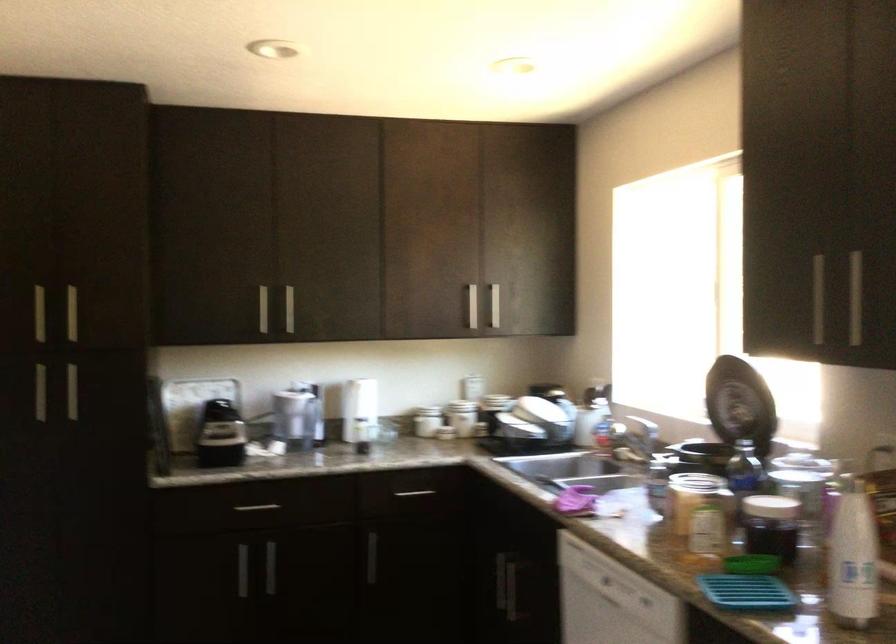
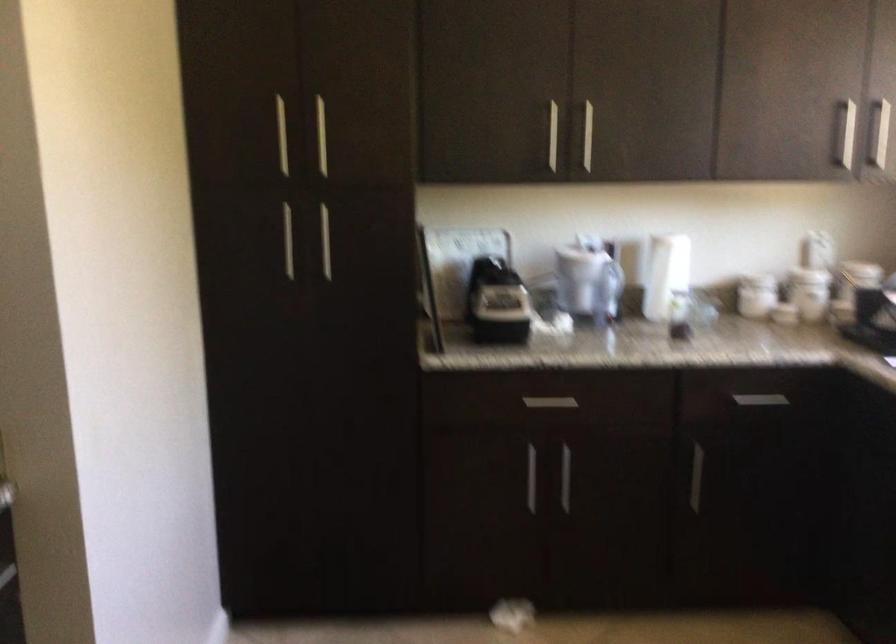
Find the pixel in the second image that matches (x=416, y=496) in the first image.

(760, 400)